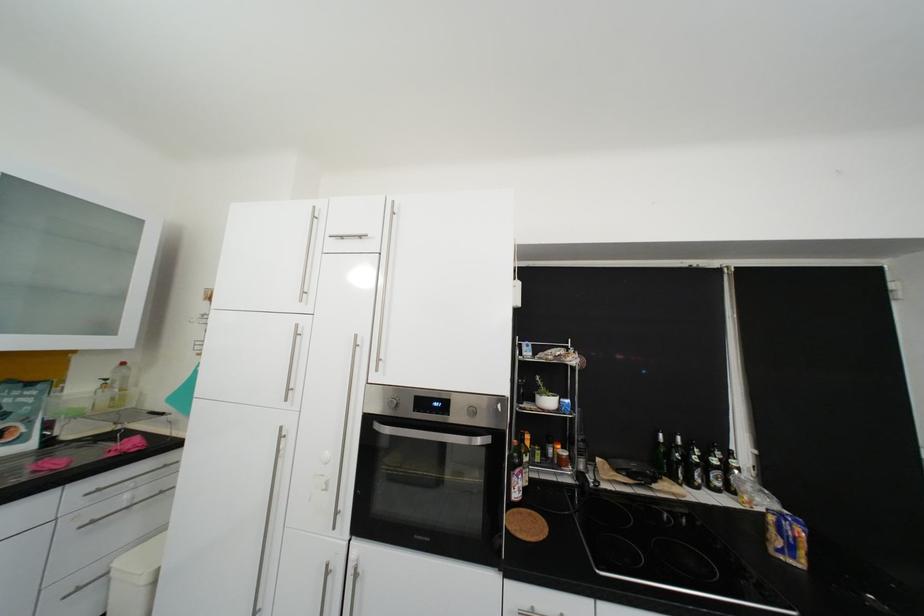
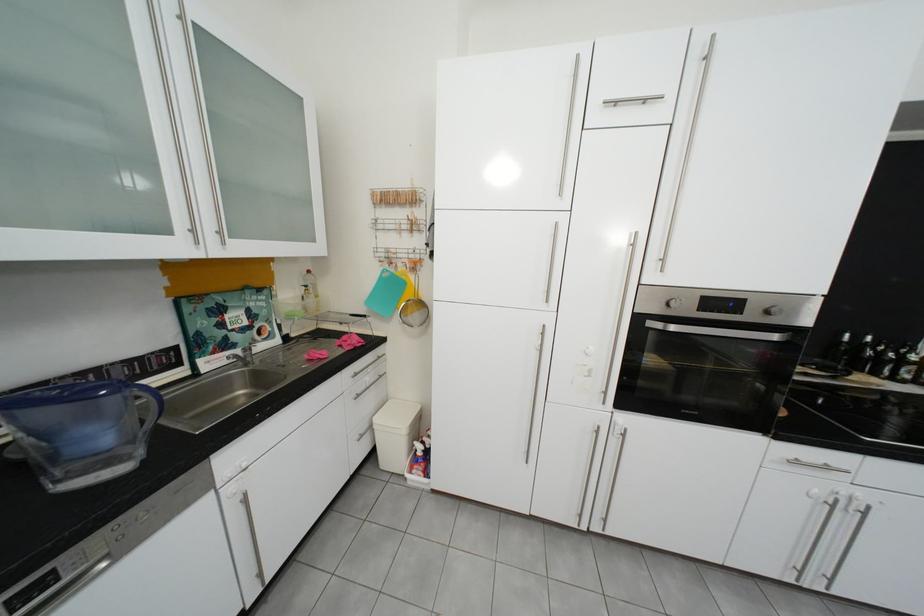
Question: In a continuous first-person perspective shot, in which direction is the camera moving?

Choices:
 (A) Left
 (B) Right
 (C) Forward
 (D) Backward

Answer: (A)